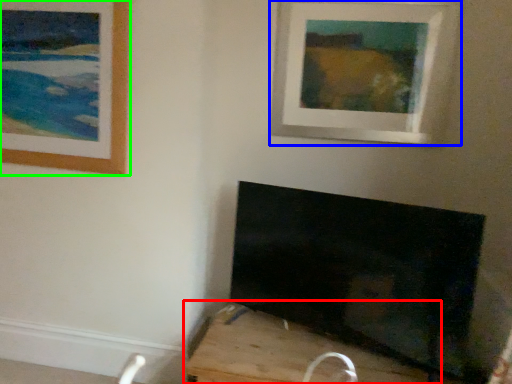
Question: Considering the real-world distances, which object is farthest from furniture (highlighted by a red box)? picture frame (highlighted by a blue box) or picture frame (highlighted by a green box)?

Choices:
 (A) picture frame
 (B) picture frame

Answer: (A)